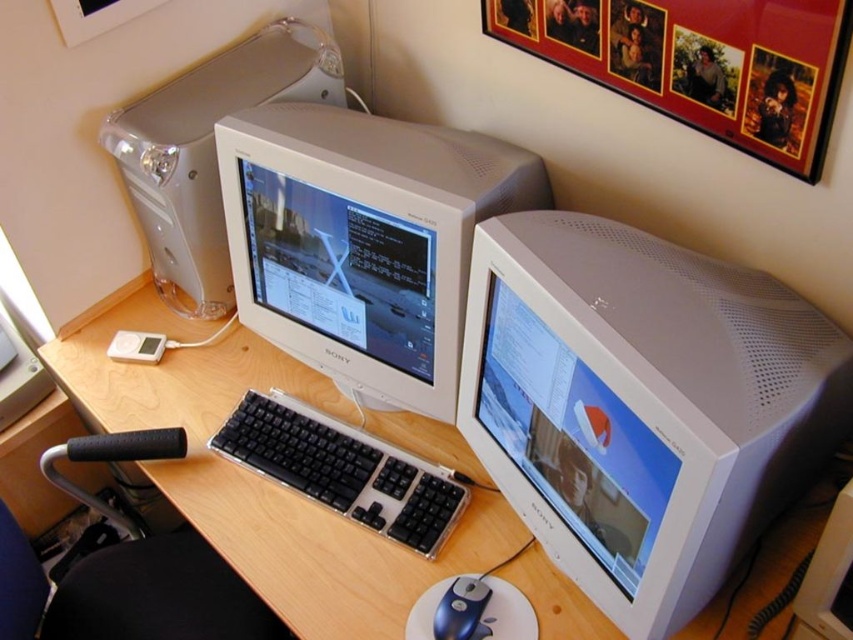
Is point (550, 426) closer to viewer compared to point (155, 282)?

That is True.

At what (x,y) coordinates should I click in order to perform the action: click on white plastic monitor at center. Please return your answer as a coordinate pair (x, y). Looking at the image, I should click on click(642, 404).

You are a GUI agent. You are given a task and a screenshot of the screen. Output one action in this format:
    pyautogui.click(x=<x>, y=<y>)
    Task: Click on the white plastic monitor at center
    The width and height of the screenshot is (853, 640).
    Given the screenshot: What is the action you would take?
    pyautogui.click(x=642, y=404)

Is wooden desk at center above blue plastic mouse at lower center?

Yes, wooden desk at center is above blue plastic mouse at lower center.

Can you confirm if wooden desk at center is thinner than blue plastic mouse at lower center?

In fact, wooden desk at center might be wider than blue plastic mouse at lower center.

Which is in front, point (268, 380) or point (463, 637)?

Point (463, 637) is more forward.

What are the coordinates of `wooden desk at center` in the screenshot? It's located at (263, 477).

Does point (241, 541) come farther from viewer compared to point (717, 109)?

Yes.

From the picture: Can you confirm if wooden desk at center is smaller than wooden-framed photo at upper right?

No.

Does point (115, 396) lie behind point (695, 3)?

Yes, point (115, 396) is behind point (695, 3).

Image resolution: width=853 pixels, height=640 pixels. Identify the location of wooden desk at center. (263, 477).